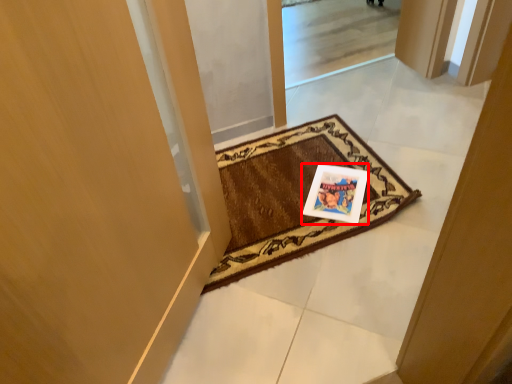
Question: From the image's perspective, what is the correct spatial relationship of postcard (annotated by the red box) in relation to mat?

Choices:
 (A) below
 (B) above

Answer: (A)